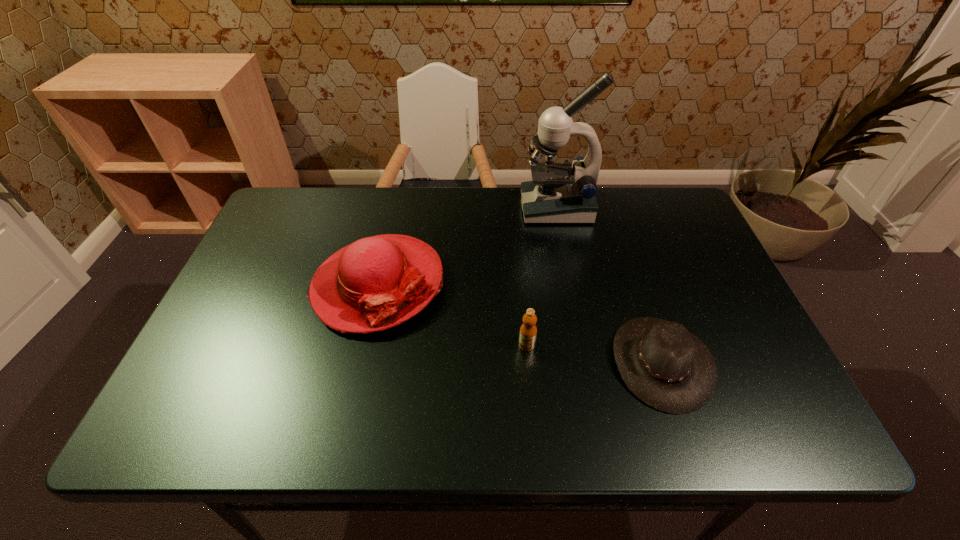
Identify the location of microscope. The width and height of the screenshot is (960, 540). (559, 193).

At what (x,y) coordinates should I click in order to perform the action: click on the farthest object. Please return your answer as a coordinate pair (x, y). The width and height of the screenshot is (960, 540). Looking at the image, I should click on (559, 193).

The image size is (960, 540). Identify the location of the taller hat. (375, 283).

Locate an element on the screen. This screenshot has height=540, width=960. the left hat is located at coordinates (375, 283).

The height and width of the screenshot is (540, 960). I want to click on orange juice, so coord(528,331).

Where is `the right hat`? The height and width of the screenshot is (540, 960). the right hat is located at coordinates (668, 368).

Locate an element on the screen. The height and width of the screenshot is (540, 960). the shortest object is located at coordinates (668, 368).

Locate an element on the screen. The width and height of the screenshot is (960, 540). vacant space located on the right of the tallest object is located at coordinates (637, 208).

Locate an element on the screen. The image size is (960, 540). free space located at the front of the taller hat with a bow is located at coordinates (349, 416).

Locate an element on the screen. The height and width of the screenshot is (540, 960). blank space located on the front label of the second object from left to right is located at coordinates (532, 405).